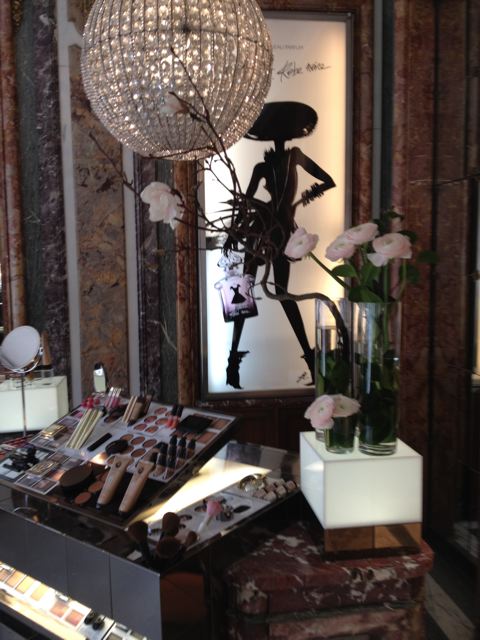
Locate an element on the screen. The height and width of the screenshot is (640, 480). perfume is located at coordinates (252, 301).